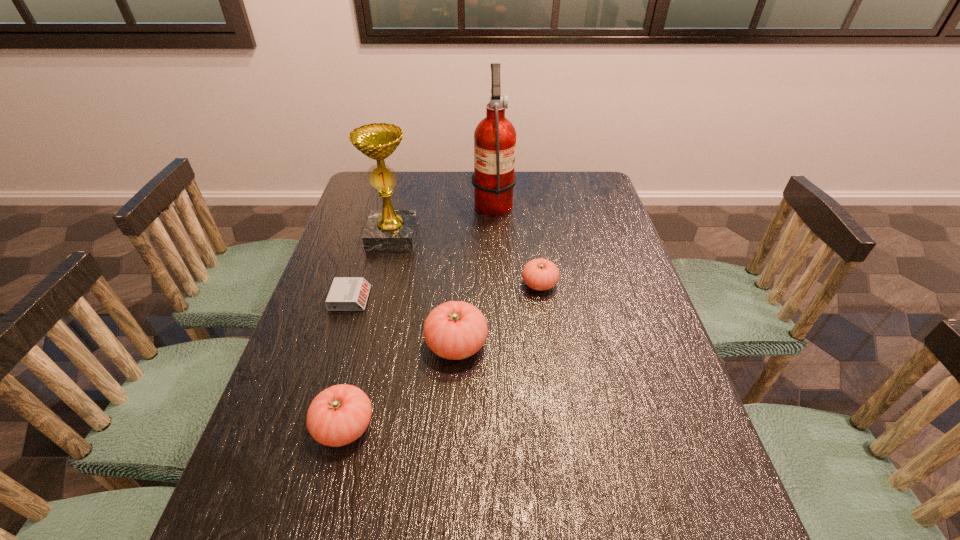
This screenshot has width=960, height=540. Identify the location of alarm clock. (346, 293).

What are the coordinates of `free space located on the right of the nearest tomato` in the screenshot? It's located at (423, 427).

The height and width of the screenshot is (540, 960). I want to click on vacant space situated on the left of the second nearest tomato, so click(x=375, y=345).

At what (x,y) coordinates should I click in order to perform the action: click on vacant space located on the front of the rightmost tomato. Please return your answer as a coordinate pair (x, y). Looking at the image, I should click on (544, 319).

Locate an element on the screen. blank area located 0.070m on the nozzle and handle of the farthest object is located at coordinates (452, 201).

Locate an element on the screen. This screenshot has height=540, width=960. blank area located on the nozzle and handle of the farthest object is located at coordinates (423, 201).

Identify the location of free space located 0.210m on the nozzle and handle of the farthest object. (412, 201).

Identify the location of free location located on the front-facing side of the fifth nearest object. (381, 282).

In order to click on free region located on the front of the shortest object in this screenshot , I will do [339, 335].

The height and width of the screenshot is (540, 960). I want to click on object present at the far edge, so click(493, 179).